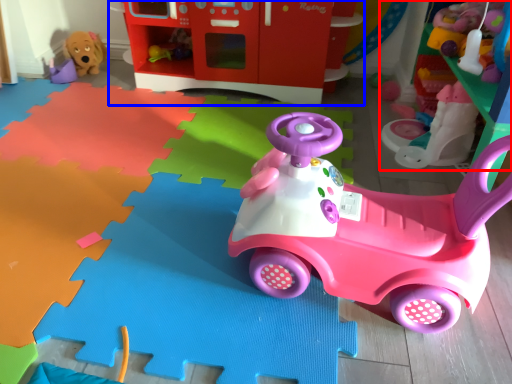
Question: Which object appears farthest to the camera in this image, toy (highlighted by a red box) or toy (highlighted by a blue box)?

Choices:
 (A) toy
 (B) toy

Answer: (B)